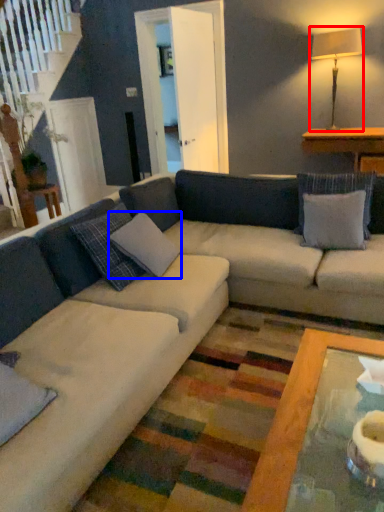
Question: Which object is further to the camera taking this photo, table lamp (highlighted by a red box) or pillow (highlighted by a blue box)?

Choices:
 (A) table lamp
 (B) pillow

Answer: (A)